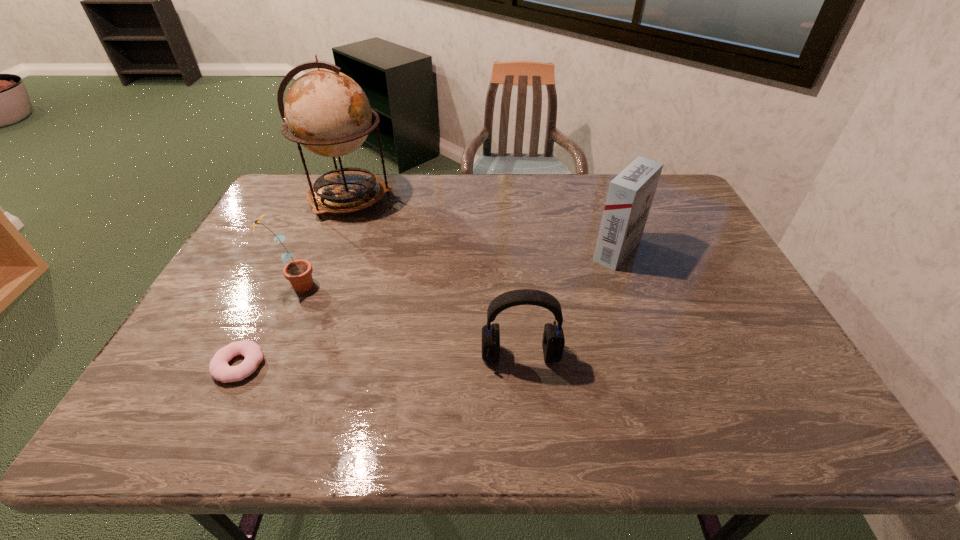
I want to click on vacant area located on the flower of the third nearest object, so click(x=451, y=286).

Locate an element on the screen. vacant area situated on the headband of the headset is located at coordinates (526, 413).

Locate an element on the screen. The height and width of the screenshot is (540, 960). free space located 0.100m on the left of the shortest object is located at coordinates (172, 365).

This screenshot has height=540, width=960. Identify the location of object positioned at the far edge. (327, 112).

Locate an element on the screen. The width and height of the screenshot is (960, 540). globe that is at the left edge is located at coordinates (327, 112).

Where is `sunflower at the left edge`? This screenshot has width=960, height=540. sunflower at the left edge is located at coordinates (299, 272).

Find the location of a particular element. doughnut at the left edge is located at coordinates click(x=219, y=369).

Locate an element on the screen. object that is at the far left corner is located at coordinates (327, 112).

Locate an element on the screen. The image size is (960, 540). free space at the far edge is located at coordinates (390, 174).

You are a GUI agent. You are given a task and a screenshot of the screen. Output one action in this format:
    pyautogui.click(x=<x>, y=<y>)
    Task: Click on the free space at the near edge of the desktop
    Image resolution: width=960 pixels, height=540 pixels.
    Given the screenshot: What is the action you would take?
    pyautogui.click(x=250, y=437)